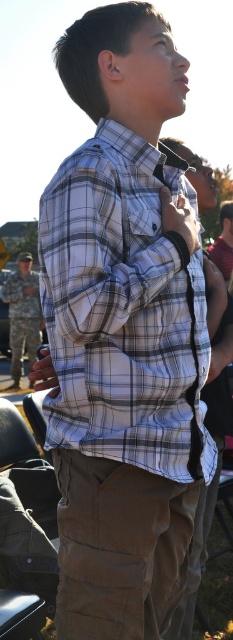
Is plaid cotton shirt at center above camouflage fabric uniform at left?

No, plaid cotton shirt at center is not above camouflage fabric uniform at left.

Between point (50, 346) and point (30, 326), which one is positioned behind?

The point (30, 326) is more distant.

Image resolution: width=233 pixels, height=640 pixels. I want to click on plaid cotton shirt at center, so click(123, 310).